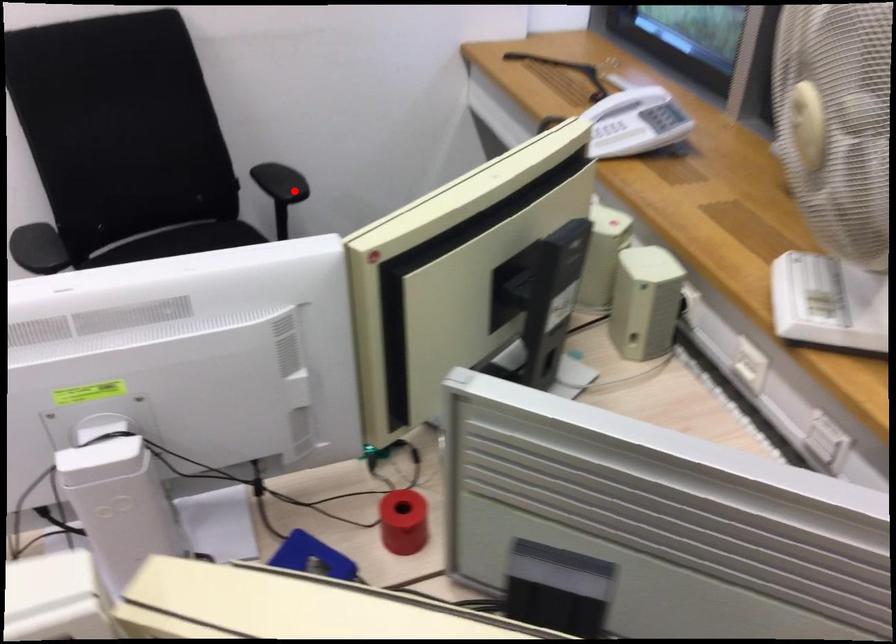
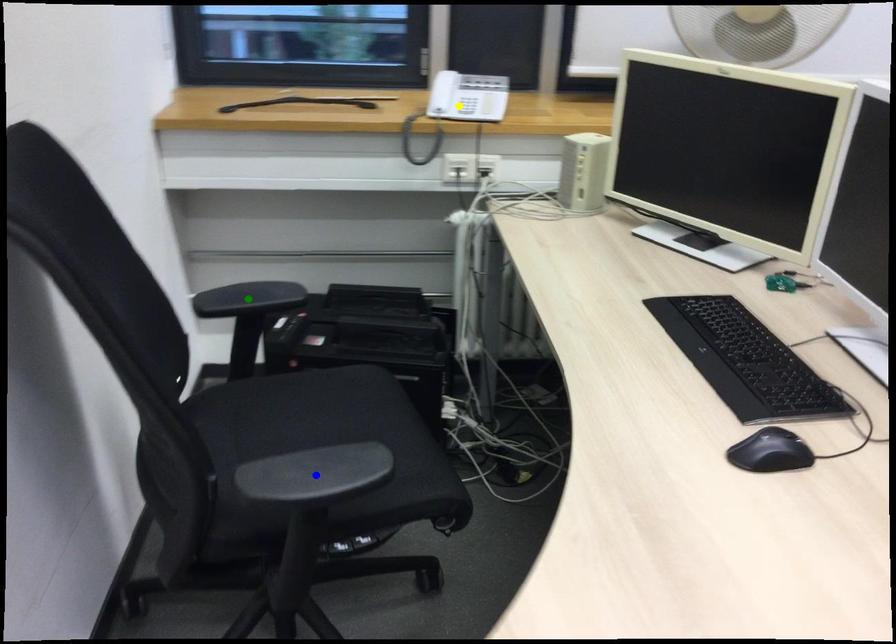
Question: I am providing you with two images of the same scene from different viewpoints. A red point is marked on the first image. You are given multiple points on the second image. Which spot in image 2 lines up with the point in image 1?

Choices:
 (A) green point
 (B) yellow point
 (C) blue point

Answer: (A)